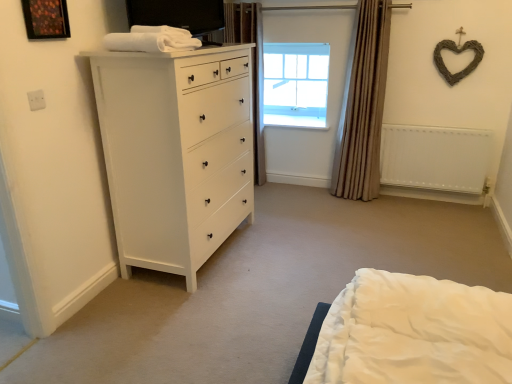
Question: From the image's perspective, is white matte radiator at right located beneath clear glass window at upper center?

Choices:
 (A) yes
 (B) no

Answer: (A)

Question: Does white matte radiator at right lie behind clear glass window at upper center?

Choices:
 (A) yes
 (B) no

Answer: (B)

Question: From a real-world perspective, is white matte radiator at right under clear glass window at upper center?

Choices:
 (A) no
 (B) yes

Answer: (B)

Question: Is white matte radiator at right wider than clear glass window at upper center?

Choices:
 (A) no
 (B) yes

Answer: (A)

Question: Does white matte radiator at right have a lesser width compared to clear glass window at upper center?

Choices:
 (A) yes
 (B) no

Answer: (A)

Question: From the image's perspective, is white matte chest of drawers at left above or below white matte radiator at right?

Choices:
 (A) above
 (B) below

Answer: (A)

Question: Considering the positions of white matte chest of drawers at left and white matte radiator at right in the image, is white matte chest of drawers at left wider or thinner than white matte radiator at right?

Choices:
 (A) thin
 (B) wide

Answer: (B)

Question: Would you say white matte chest of drawers at left is to the left or to the right of white matte radiator at right in the picture?

Choices:
 (A) left
 (B) right

Answer: (A)

Question: Which is correct: white matte chest of drawers at left is inside white matte radiator at right, or outside of it?

Choices:
 (A) inside
 (B) outside

Answer: (B)

Question: Does point (278, 115) appear closer or farther from the camera than point (252, 49)?

Choices:
 (A) closer
 (B) farther

Answer: (B)

Question: Is clear glass window at upper center to the left or to the right of brown textured curtain at upper center, acting as the second curtain starting from the right, in the image?

Choices:
 (A) left
 (B) right

Answer: (B)

Question: Looking at the image, does clear glass window at upper center seem bigger or smaller compared to brown textured curtain at upper center, which is counted as the 1th curtain, starting from the left?

Choices:
 (A) big
 (B) small

Answer: (B)

Question: In terms of width, does clear glass window at upper center look wider or thinner when compared to brown textured curtain at upper center, which is counted as the 1th curtain, starting from the left?

Choices:
 (A) thin
 (B) wide

Answer: (A)

Question: Is white matte chest of drawers at left taller or shorter than clear glass window at upper center?

Choices:
 (A) tall
 (B) short

Answer: (A)

Question: In terms of width, does white matte chest of drawers at left look wider or thinner when compared to clear glass window at upper center?

Choices:
 (A) thin
 (B) wide

Answer: (B)